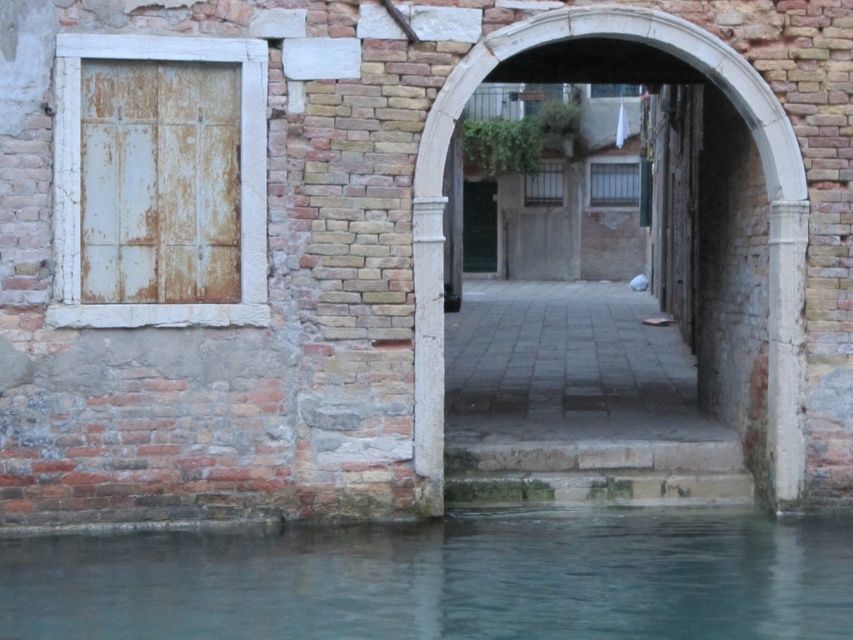
You are standing at the point marked by the coordinates point (764, 188) in the image. What architectural feature are you facing directly?

The point (764, 188) corresponds to the white stone archway at center, so you are facing the white stone archway at center directly.

You are a tourist standing at the edge of the canal and see the clear water at lower center and the rusty white door at left. Which object is closer to you?

The clear water at lower center is closer to you since it is in front of the rusty white door at left.